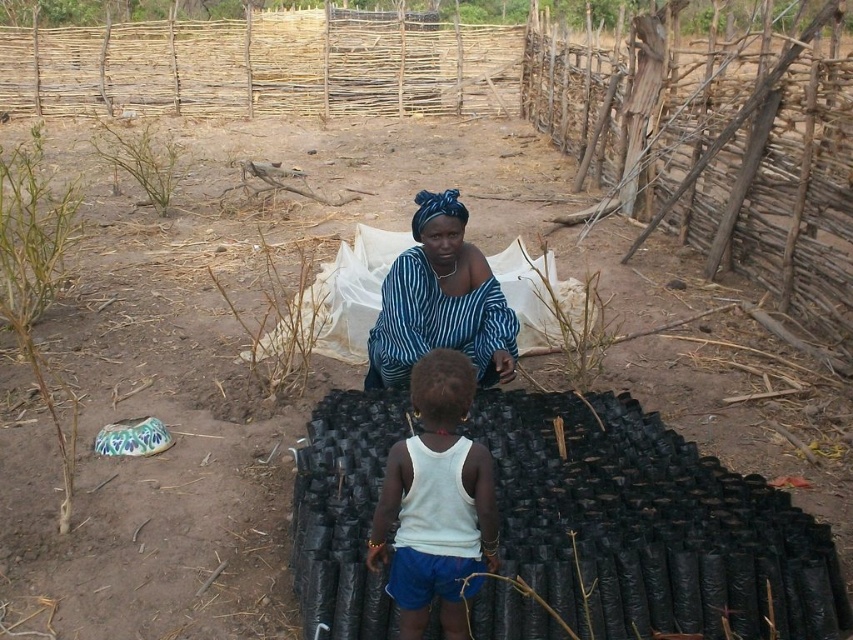
You are a fashion designer observing a woman in a rural setting. She is wearing a white matte tank top at center and a blue striped fabric at center. Which piece of clothing is shorter?

The white matte tank top at center is shorter than the blue striped fabric at center.